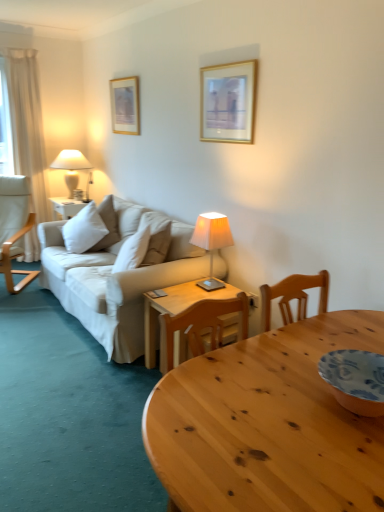
Identify the location of vacant space situated on the left part of wooden chair at center, the second chair from the back. (124, 379).